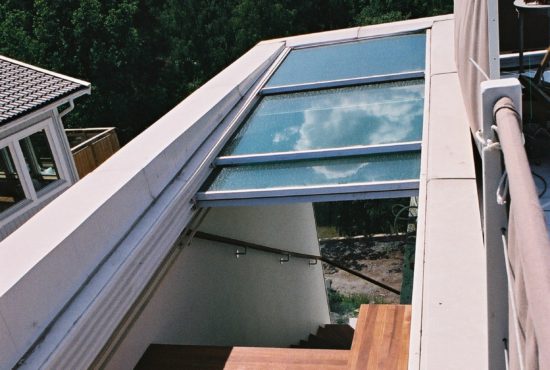
You are a GUI agent. You are given a task and a screenshot of the screen. Output one action in this format:
    pyautogui.click(x=<x>, y=<y>)
    Task: Click on the bracket attaching railing to wall
    The image size is (550, 370).
    Given the screenshot: What is the action you would take?
    pyautogui.click(x=240, y=253)